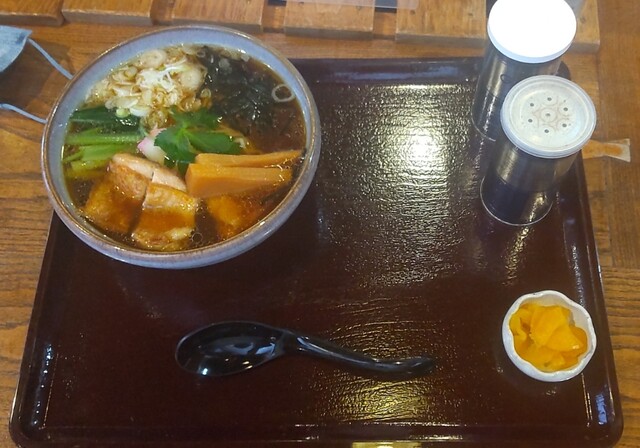
At what (x,y) coordinates should I click in order to perform the action: click on spoon. Please return your answer as a coordinate pair (x, y). Looking at the image, I should click on (237, 341).